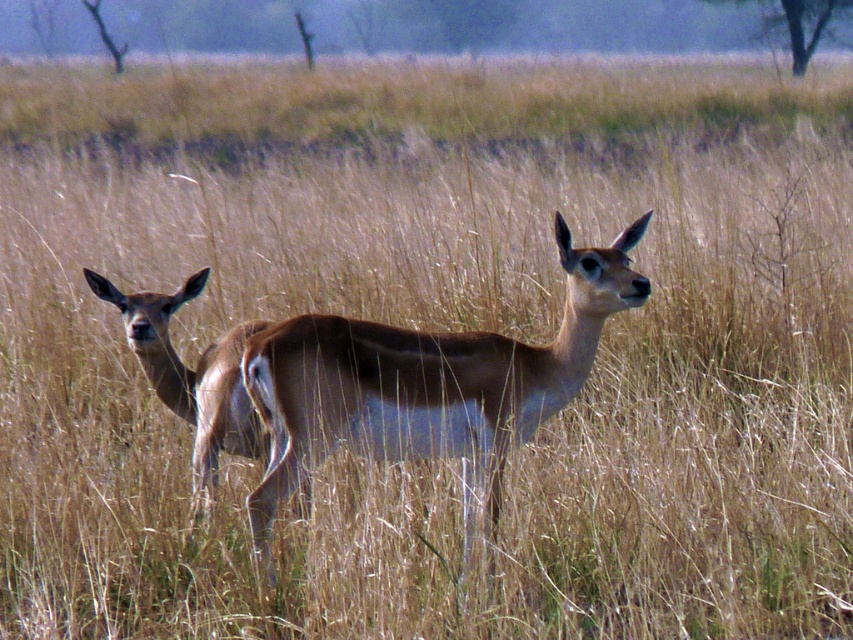
You are a wildlife photographer aiming to capture a photo of both brown glossy deer at center and brown glossy deer at left. Based on their positions, which deer should you focus on first to ensure both are in the frame?

The brown glossy deer at center is located below the brown glossy deer at left, so you should focus on the brown glossy deer at left first to ensure both are in the frame.

Based on the photo, you are a wildlife photographer aiming to capture both brown glossy deer at center and brown glossy deer at left in a single frame. Based on their positions, which deer should you focus on first to ensure both are in the frame?

The brown glossy deer at center is taller than the brown glossy deer at left, so focusing on the taller deer at center first will help ensure both are in the frame.